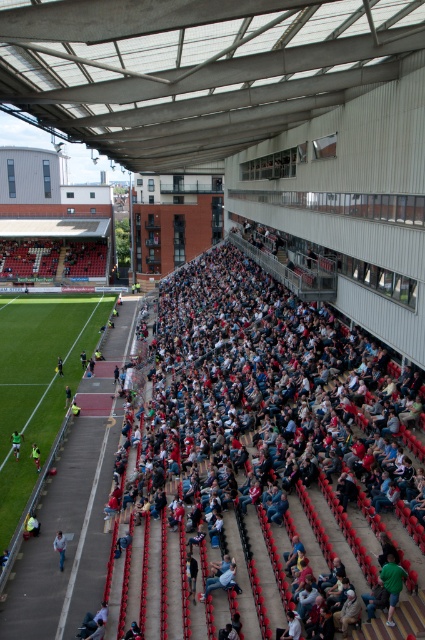
Question: Which object appears closest to the camera in this image?

Choices:
 (A) green jersey at lower left
 (B) red plastic seats at center
 (C) yellow-green jersey at lower left
 (D) yellow jersey at lower left

Answer: (B)

Question: Is yellow-green jersey at lower left positioned before dark blue jersey at lower left?

Choices:
 (A) yes
 (B) no

Answer: (A)

Question: Does denim jeans at lower left have a lesser width compared to dark blue jersey at lower left?

Choices:
 (A) yes
 (B) no

Answer: (B)

Question: Which point is farther from the camera taking this photo?

Choices:
 (A) (391, 614)
 (B) (39, 529)

Answer: (B)

Question: Which point appears closest to the camera in this image?

Choices:
 (A) (62, 552)
 (B) (70, 394)
 (C) (34, 458)

Answer: (A)

Question: Does green jersey at lower left have a larger size compared to yellow fabric jacket at lower left?

Choices:
 (A) no
 (B) yes

Answer: (B)